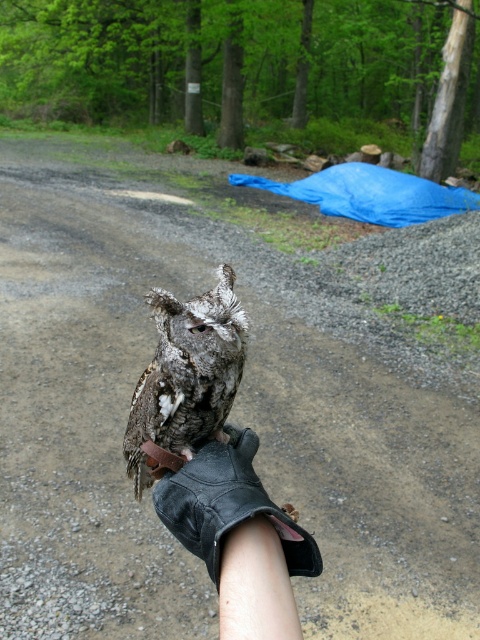
Who is more distant from viewer, (199,504) or (151,412)?

The point (151,412) is more distant.

Identify the location of black leather glove at center. (239, 538).